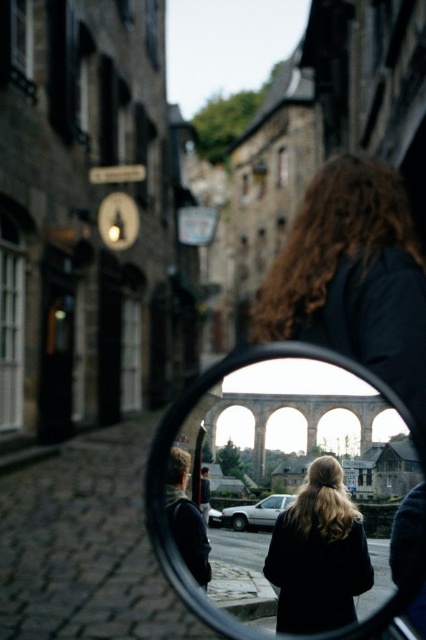
You are a photographer trying to capture the reflection of the arched bridge in the clear glass mirror at center. However, the dark wool coat at center is blocking your view. Can you move the coat to the side to get a better shot?

The clear glass mirror at center is positioned over the dark wool coat at center, so you can move the coat to the side to get a better shot without obstructing the mirror.

You are a delivery person carrying a package that is 3 meters long. You need to walk through a narrow alley between the clear glass mirror at center and the dark wool coat at center. Can your package fit through the space between them?

The distance between the clear glass mirror at center and the dark wool coat at center is 3.69 meters, so the 3 meter long package can fit through the space between them since it is shorter than the available distance.

In the scene shown: You are standing in front of the mirror and want to touch both the clear glass mirror at center and the dark wool coat at center. Which object will your hand reach first?

The clear glass mirror at center is closer to the viewer than the dark wool coat at center, so you will reach the clear glass mirror at center first.